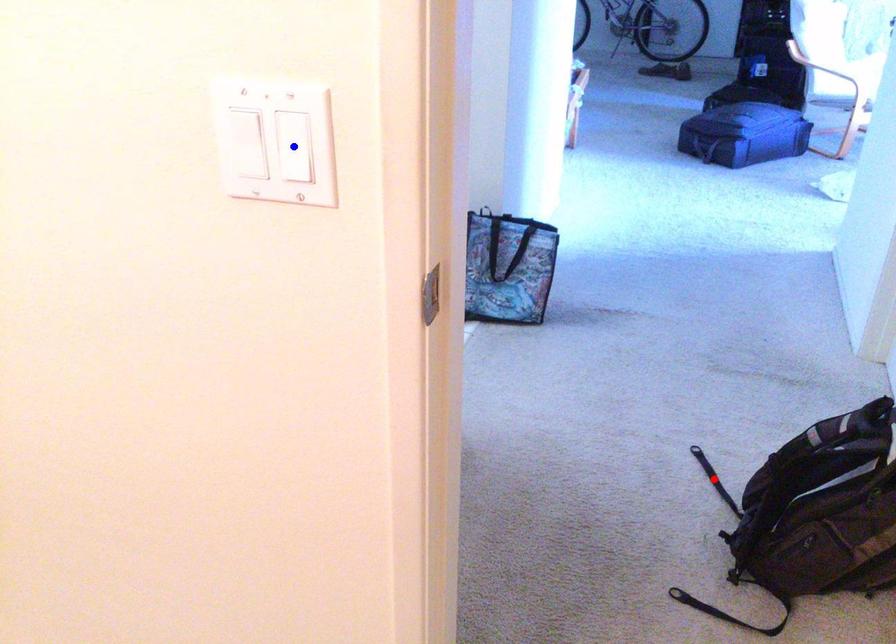
Question: In the image, two points are highlighted. Which point is nearer to the camera? Reply with the corresponding letter.

Choices:
 (A) blue point
 (B) red point

Answer: (A)